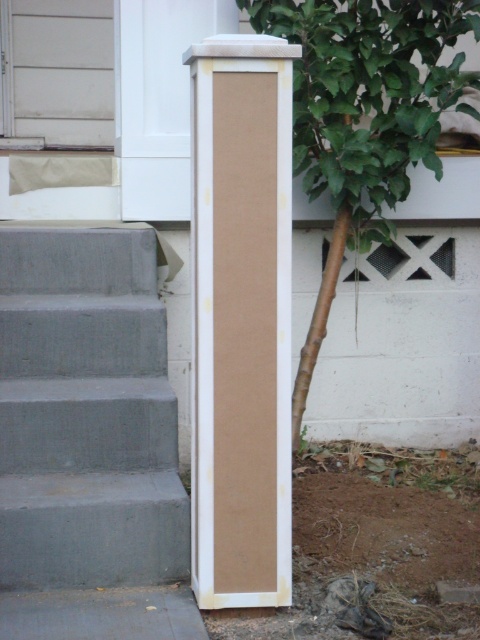
You are a gardener planning to plant a new flower bed between the matte cardboard pillar at center and the green leafy tree at center. Based on their positions, which object should you start digging near to create the flower bed?

The matte cardboard pillar at center is to the left of the green leafy tree at center, so you should start digging near the matte cardboard pillar at center to create the flower bed between them.

You are standing at the base of the gray concrete stairs at lower left. Looking towards the newly installed white column, which direction should you face to see it?

The white column is positioned near the concrete steps leading up to the house, so facing towards the column from the stairs would require turning towards the right since the column is to the right of the stairs.

You are standing at the bottom of the steps and want to walk towards the house. Is the matte cardboard pillar at center blocking your direct path to the green leafy tree at center?

The matte cardboard pillar at center is in front of the green leafy tree at center, so it would block your direct path to the green leafy tree at center.